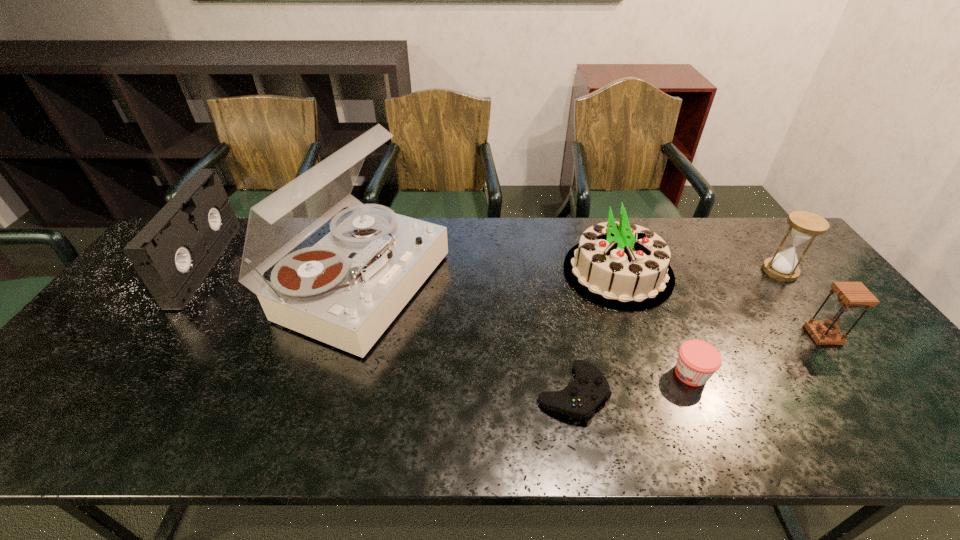
Locate an element on the screen. the tallest object is located at coordinates (345, 291).

Find the location of `record player`. record player is located at coordinates (345, 291).

Where is `the leftmost object`? This screenshot has height=540, width=960. the leftmost object is located at coordinates (173, 254).

Identify the location of birthday cake. (619, 265).

The image size is (960, 540). In order to click on the farther hourglass in this screenshot , I will do `click(804, 226)`.

At what (x,y) coordinates should I click in order to perform the action: click on the shorter hourglass. Please return your answer as a coordinate pair (x, y). This screenshot has height=540, width=960. Looking at the image, I should click on (851, 295).

Image resolution: width=960 pixels, height=540 pixels. I want to click on the third shortest object, so click(851, 295).

Locate an element on the screen. The width and height of the screenshot is (960, 540). jam is located at coordinates (697, 361).

Where is `the shortest object`? The width and height of the screenshot is (960, 540). the shortest object is located at coordinates (579, 399).

What are the coordinates of `free space located 0.100m on the front of the tallest object` in the screenshot? It's located at (326, 396).